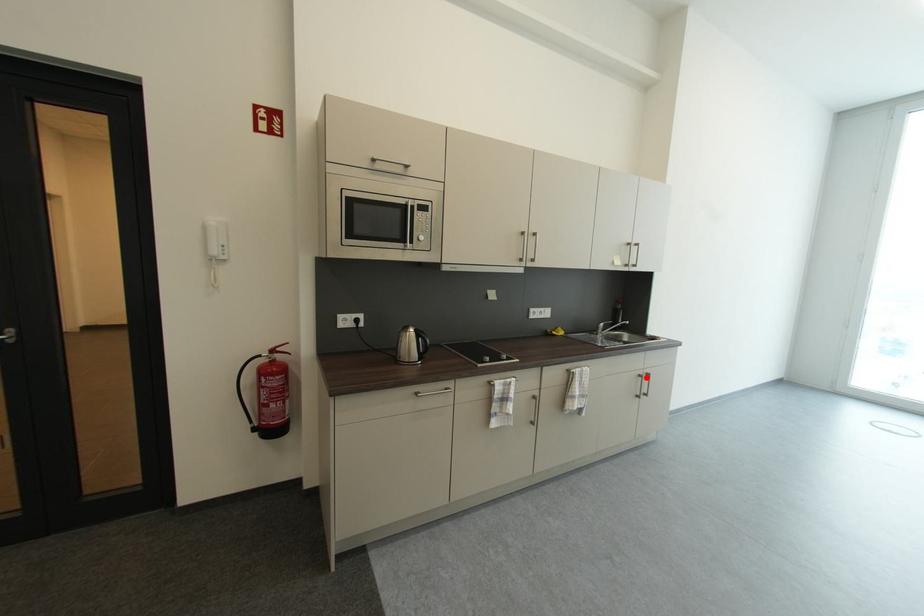
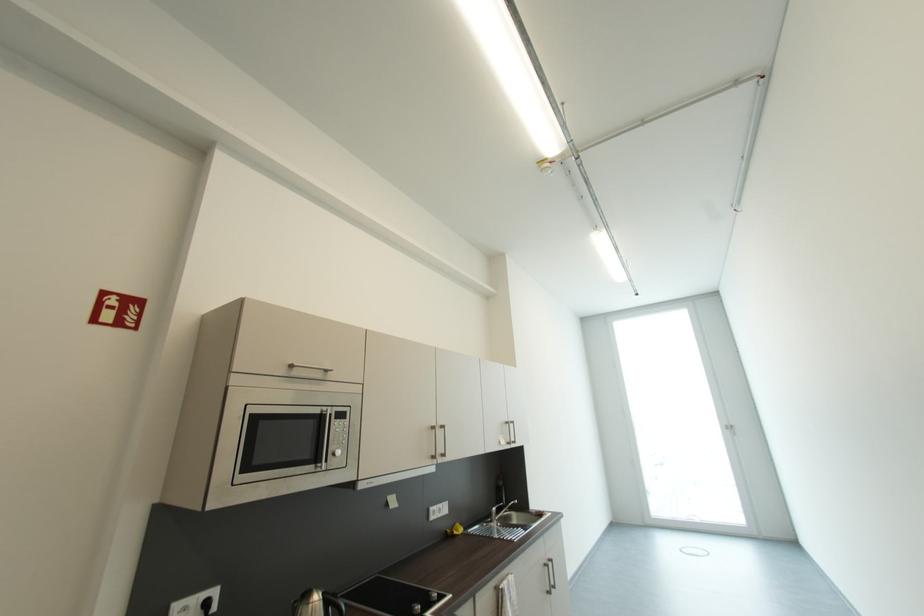
In the second image, find the point that corresponds to the highlighted location in the first image.

(552, 567)